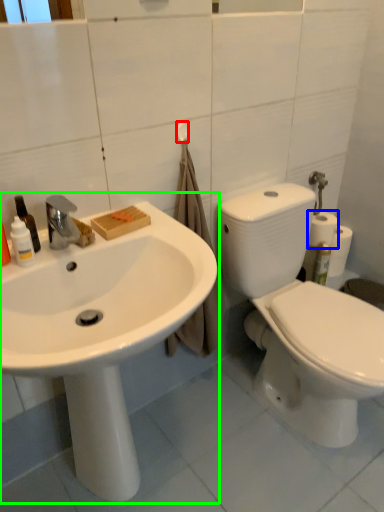
Question: Considering the real-world distances, which object is closest to towel bar (highlighted by a red box)? toilet paper (highlighted by a blue box) or sink (highlighted by a green box).

Choices:
 (A) toilet paper
 (B) sink

Answer: (B)